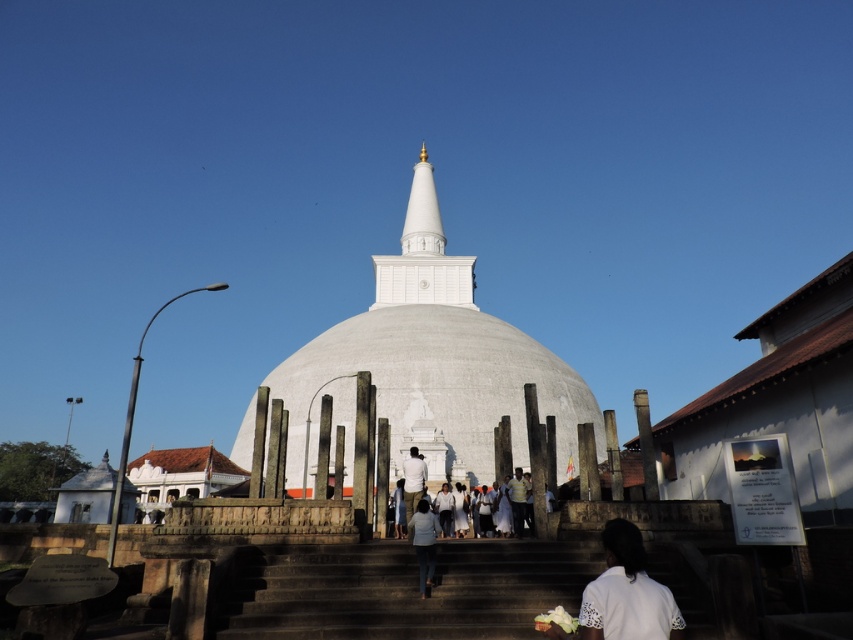
Question: Considering the relative positions of white smooth stupa at center and white fabric shirt at center in the image provided, where is white smooth stupa at center located with respect to white fabric shirt at center?

Choices:
 (A) left
 (B) right

Answer: (A)

Question: Which object appears closest to the camera in this image?

Choices:
 (A) denim pants at center
 (B) white smooth dome at center
 (C) white fabric shirt at center

Answer: (A)

Question: Does dark stone stairs at center have a greater width compared to denim pants at center?

Choices:
 (A) no
 (B) yes

Answer: (B)

Question: Which of the following is the farthest from the observer?

Choices:
 (A) white lace shirt at lower right
 (B) denim pants at center
 (C) white fabric shirt at center
 (D) white smooth stupa at center

Answer: (D)

Question: Which point is farther from the camera taking this photo?

Choices:
 (A) (405, 515)
 (B) (622, 563)
 (C) (527, 358)

Answer: (C)

Question: Where is white fabric shirt at center located in relation to light blue fabric at center in the image?

Choices:
 (A) below
 (B) above

Answer: (B)